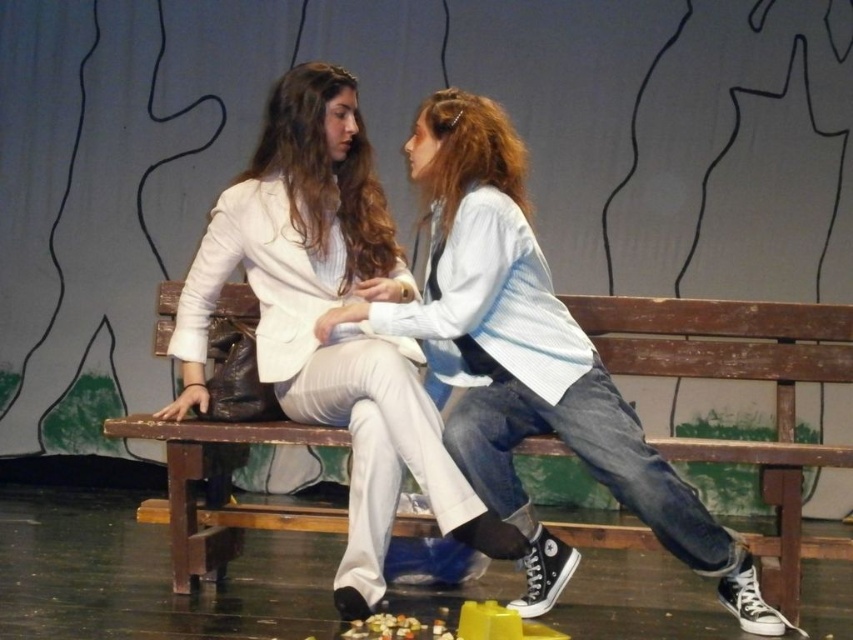
Question: Which is nearer to the white matte blazer at center?

Choices:
 (A) wooden bench at center
 (B) matte white blouse at center

Answer: (B)

Question: Among these objects, which one is nearest to the camera?

Choices:
 (A) matte white blouse at center
 (B) wooden bench at center
 (C) white matte blazer at center

Answer: (C)

Question: Does matte white blouse at center lie in front of wooden bench at center?

Choices:
 (A) yes
 (B) no

Answer: (A)

Question: Estimate the real-world distances between objects in this image. Which object is closer to the wooden bench at center?

Choices:
 (A) matte white blouse at center
 (B) white matte blazer at center

Answer: (A)

Question: Can you confirm if white matte blazer at center is smaller than matte white blouse at center?

Choices:
 (A) no
 (B) yes

Answer: (A)

Question: Is matte white blouse at center further to the viewer compared to wooden bench at center?

Choices:
 (A) no
 (B) yes

Answer: (A)